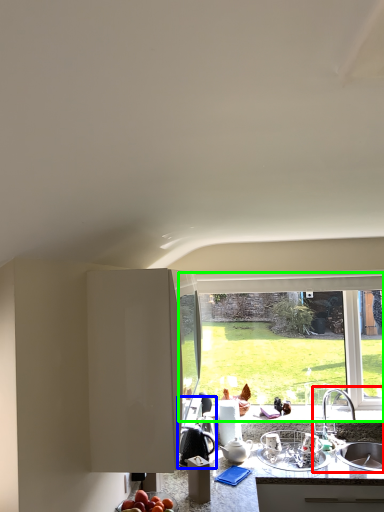
Question: Which object is positioned farthest from sink (highlighted by a red box)? Select from appliance (highlighted by a blue box) and window (highlighted by a green box).

Choices:
 (A) appliance
 (B) window

Answer: (A)